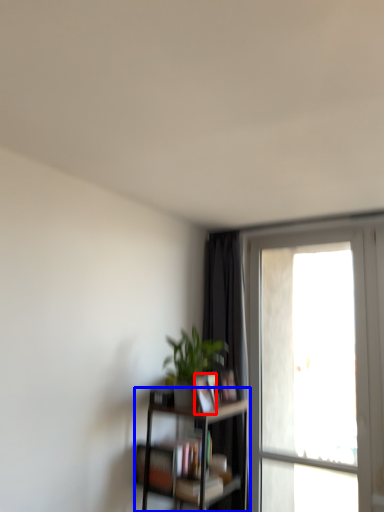
Question: Which object is closer to the camera taking this photo, book (highlighted by a red box) or shelf (highlighted by a blue box)?

Choices:
 (A) book
 (B) shelf

Answer: (B)